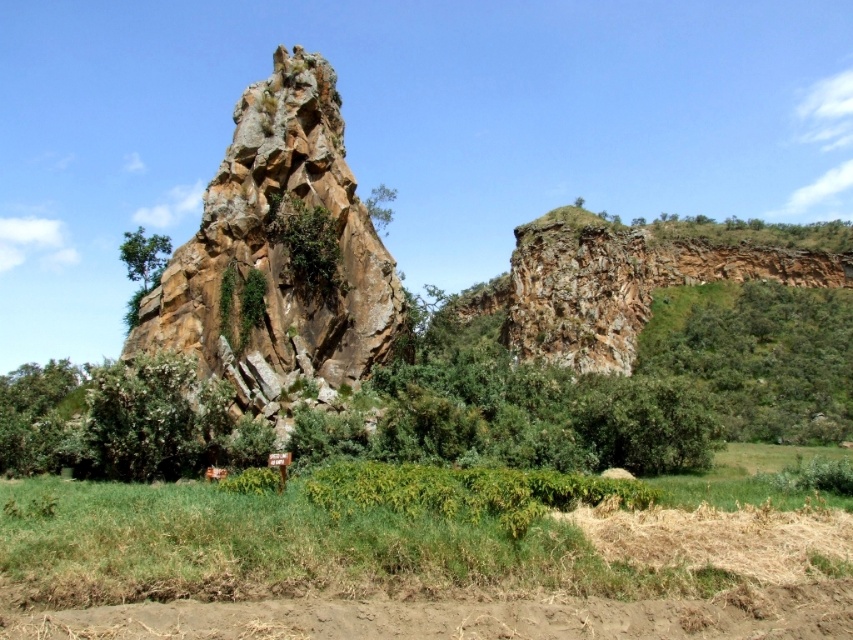
You are a hiker trying to navigate between the two rocky formations in the scene. You need to place a marker exactly halfway between the green leafy shrub at upper right and the top of the left rock formation. What are the coordinates of this midpoint?

The coordinates of the midpoint between the green leafy shrub at upper right and the top of the left rock formation would be calculated by averaging their coordinates. Since the shrub is at point (758, 355), and the top of the left rock formation is at an assumed coordinate of (212, 160), the midpoint would be at approximately (485, 257).